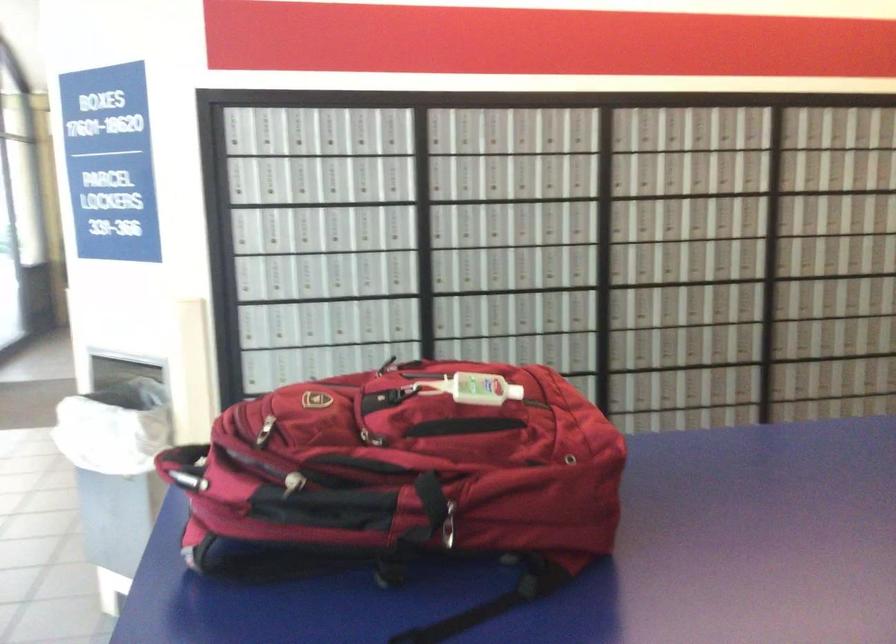
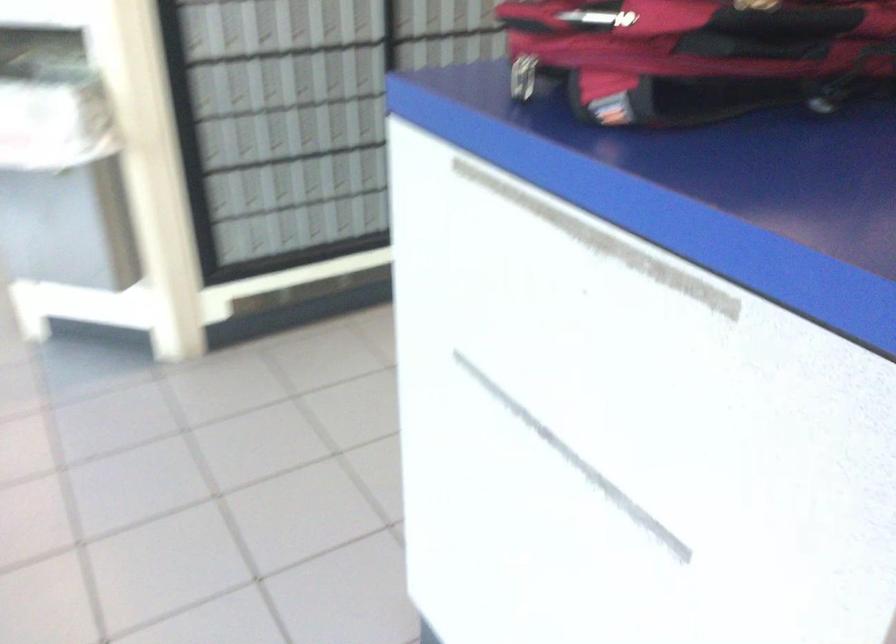
Find the pixel in the second image that matches point 250,522 in the first image.

(696, 55)